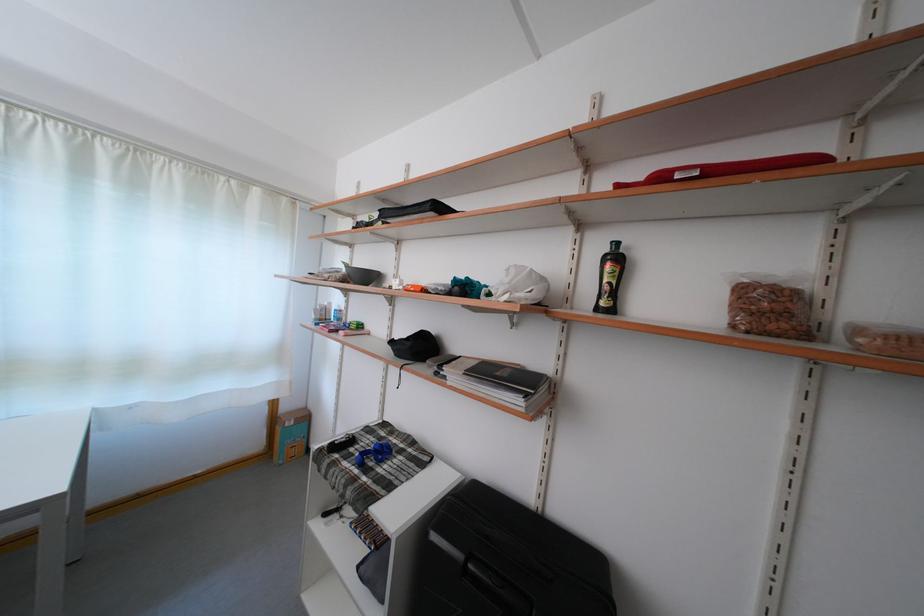
The location [769,307] corresponds to which object?

This point indicates the plastic bag of nuts.